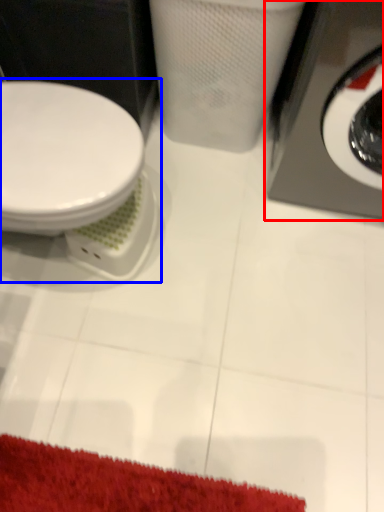
Question: Among these objects, which one is nearest to the camera, washing machine (highlighted by a red box) or toilet (highlighted by a blue box)?

Choices:
 (A) washing machine
 (B) toilet

Answer: (A)